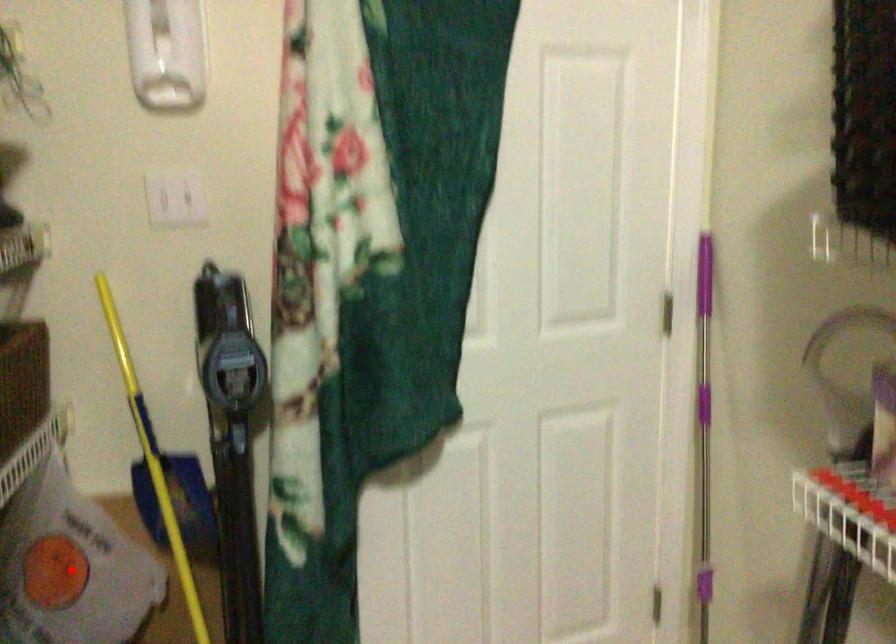
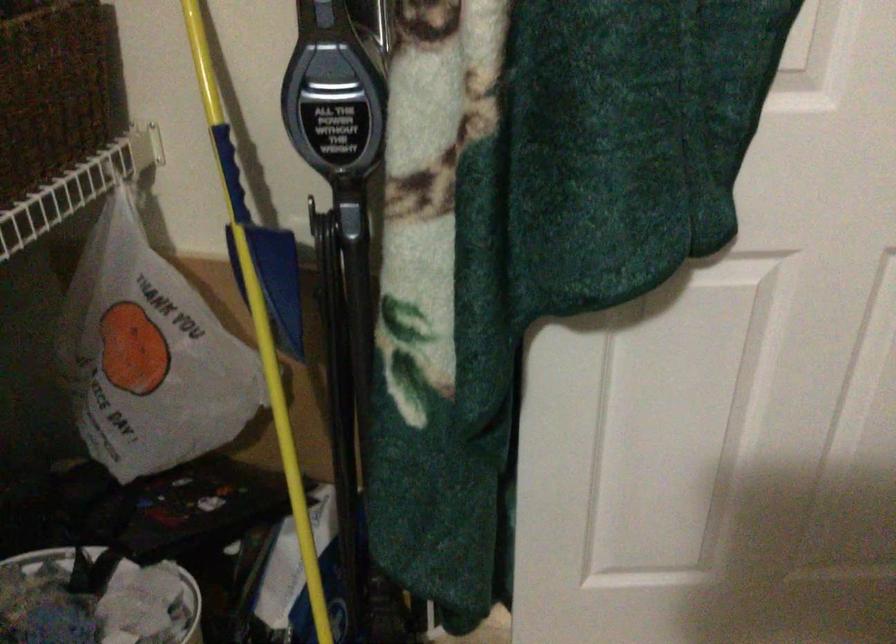
The point at the highlighted location is marked in the first image. Where is the corresponding point in the second image?

(149, 355)